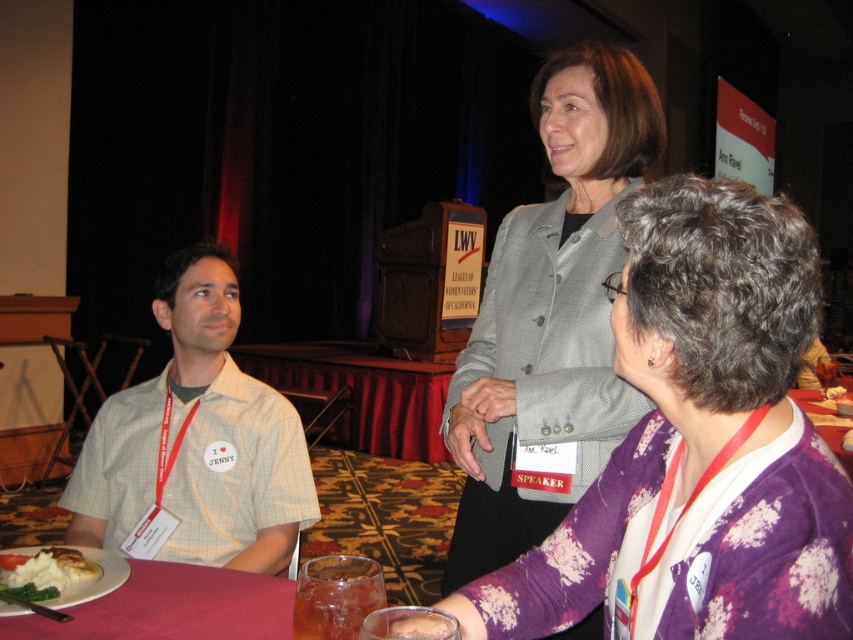
You are a photographer at the event and need to capture a photo of the beige checkered shirt at left and the white mashed potato at lower left. Which object should you focus on first if you want to ensure both are in frame without moving the camera?

The beige checkered shirt at left is wider than the white mashed potato at lower left, so focusing on the wider beige checkered shirt at left first will help ensure both fit in the frame.

You are a photographer at the event and need to capture a closeup of the gray textured blazer at upper center without the white mashed potato at lower left appearing in the frame. Is this possible given their sizes?

The gray textured blazer at upper center is larger in size than the white mashed potato at lower left. Since the blazer is bigger, it can potentially block the view of the mashed potato if positioned correctly, making it possible to take a closeup of the blazer without the potato appearing in the frame.

In the scene shown: You are a guest at the event and want to avoid spilling your drink on the gray textured blazer at upper center. Since you are standing near the white mashed potato at lower left, which object should you move away from to keep the blazer safe?

You should move away from the white mashed potato at lower left because the gray textured blazer at upper center is positioned over it, so staying near the mashed potato could risk spilling onto the blazer.